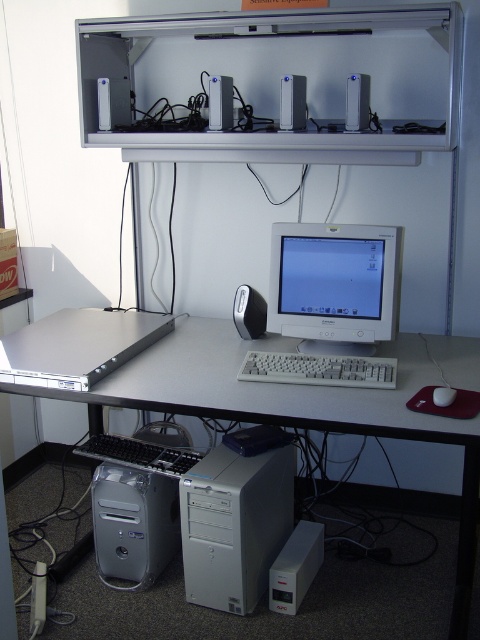
In the scene shown: Is white plastic keyboard at center closer to camera compared to white plastic mouse at lower right?

No, white plastic keyboard at center is behind white plastic mouse at lower right.

Does white plastic keyboard at center have a lesser height compared to white plastic mouse at lower right?

In fact, white plastic keyboard at center may be taller than white plastic mouse at lower right.

Is point (240, 372) positioned after point (439, 403)?

Yes, it is.

You are a GUI agent. You are given a task and a screenshot of the screen. Output one action in this format:
    pyautogui.click(x=<x>, y=<y>)
    Task: Click on the white plastic keyboard at center
    
    Given the screenshot: What is the action you would take?
    pyautogui.click(x=319, y=369)

Is white plastic computer desk at center taller than white plastic mouse at lower right?

Correct, white plastic computer desk at center is much taller as white plastic mouse at lower right.

Between white plastic computer desk at center and white plastic mouse at lower right, which one appears on the right side from the viewer's perspective?

Positioned to the right is white plastic mouse at lower right.

The width and height of the screenshot is (480, 640). I want to click on white plastic computer desk at center, so point(300,403).

Between point (332, 332) and point (435, 403), which one is positioned behind?

The point (332, 332) is behind.

Is matte gray monitor at center wider than white plastic mouse at lower right?

Yes, matte gray monitor at center is wider than white plastic mouse at lower right.

Identify the location of matte gray monitor at center. The width and height of the screenshot is (480, 640). (335, 284).